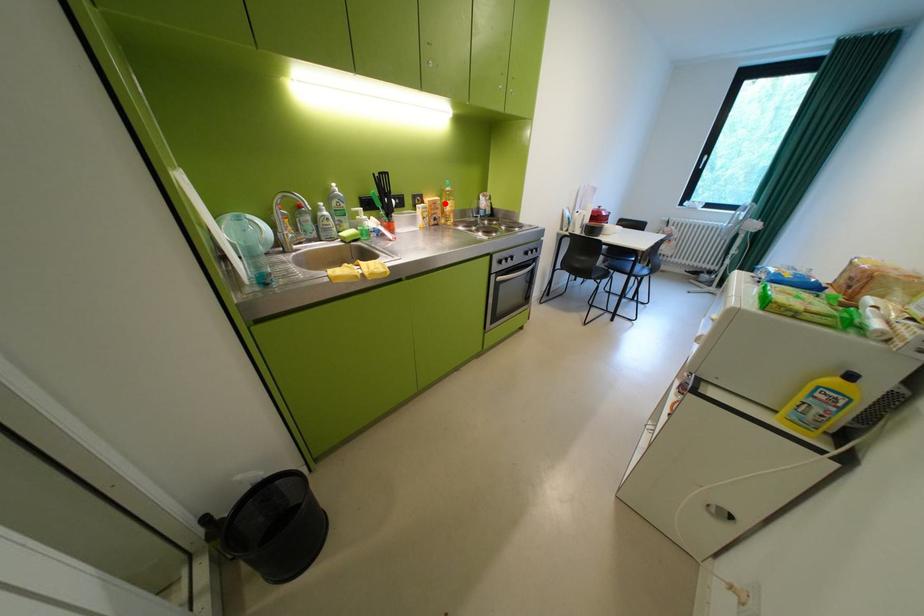
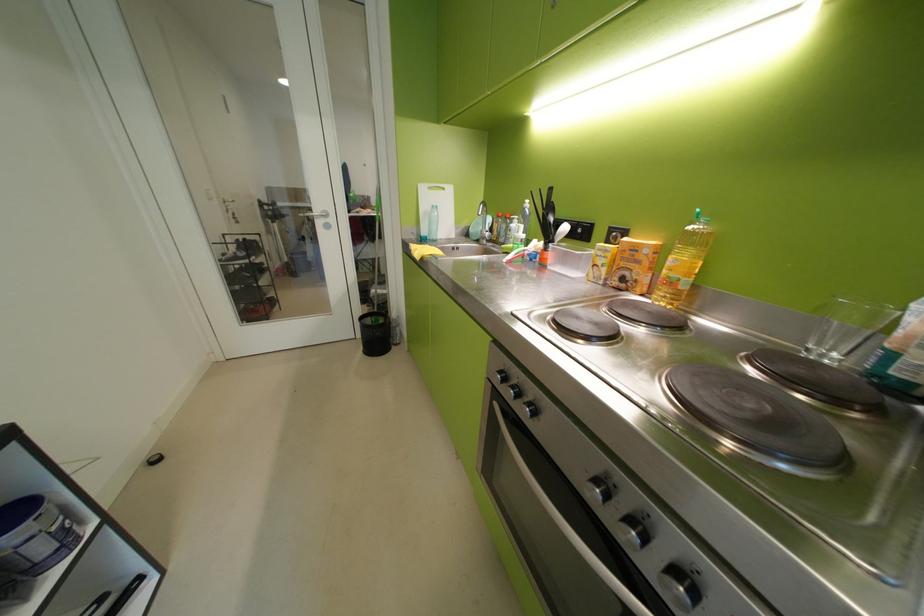
The point at the highlighted location is marked in the first image. Where is the corresponding point in the second image?

(646, 249)